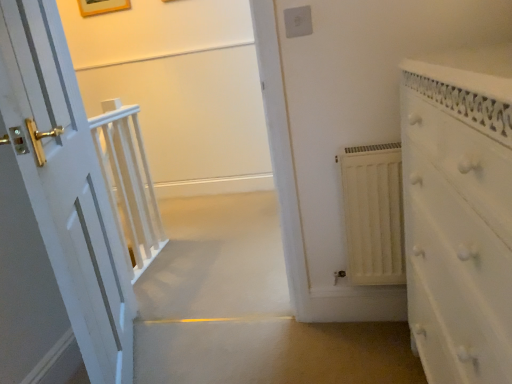
Question: From a real-world perspective, is white matte radiator at center right on top of white textured dresser at right?

Choices:
 (A) yes
 (B) no

Answer: (B)

Question: Is white matte radiator at center right oriented towards white textured dresser at right?

Choices:
 (A) yes
 (B) no

Answer: (A)

Question: From the image's perspective, is white matte radiator at center right below white textured dresser at right?

Choices:
 (A) no
 (B) yes

Answer: (A)

Question: Is white matte radiator at center right located outside white textured dresser at right?

Choices:
 (A) no
 (B) yes

Answer: (B)

Question: From the image's perspective, is white matte radiator at center right above white textured dresser at right?

Choices:
 (A) yes
 (B) no

Answer: (A)

Question: In the image, is white plastic electric outlet at upper center positioned in front of or behind white matte radiator at center right?

Choices:
 (A) front
 (B) behind

Answer: (B)

Question: In the image, is white plastic electric outlet at upper center on the left side or the right side of white matte radiator at center right?

Choices:
 (A) right
 (B) left

Answer: (B)

Question: From the image's perspective, is white plastic electric outlet at upper center positioned above or below white matte radiator at center right?

Choices:
 (A) above
 (B) below

Answer: (A)

Question: Looking at their shapes, would you say white plastic electric outlet at upper center is wider or thinner than white matte radiator at center right?

Choices:
 (A) thin
 (B) wide

Answer: (A)

Question: Considering the positions of point (292, 36) and point (115, 0), is point (292, 36) closer or farther from the camera than point (115, 0)?

Choices:
 (A) farther
 (B) closer

Answer: (B)

Question: Considering the positions of white plastic electric outlet at upper center and wooden picture frame at upper center in the image, is white plastic electric outlet at upper center wider or thinner than wooden picture frame at upper center?

Choices:
 (A) wide
 (B) thin

Answer: (B)

Question: Is white plastic electric outlet at upper center inside or outside of wooden picture frame at upper center?

Choices:
 (A) inside
 (B) outside

Answer: (B)

Question: Looking at the image, does white plastic electric outlet at upper center seem bigger or smaller compared to wooden picture frame at upper center?

Choices:
 (A) small
 (B) big

Answer: (A)

Question: From the image's perspective, is white wooden balustrade at center positioned above or below white plastic electric outlet at upper center?

Choices:
 (A) below
 (B) above

Answer: (A)

Question: Considering the positions of white wooden balustrade at center and white plastic electric outlet at upper center in the image, is white wooden balustrade at center bigger or smaller than white plastic electric outlet at upper center?

Choices:
 (A) big
 (B) small

Answer: (A)